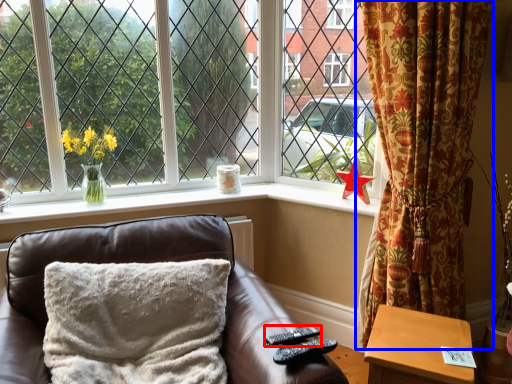
Question: Which of the following is the closest to the observer, remote (highlighted by a red box) or curtain (highlighted by a blue box)?

Choices:
 (A) remote
 (B) curtain

Answer: (A)